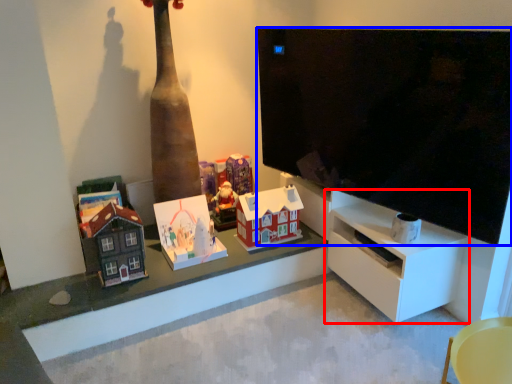
Question: Among these objects, which one is farthest to the camera, shelf (highlighted by a red box) or television (highlighted by a blue box)?

Choices:
 (A) shelf
 (B) television

Answer: (A)